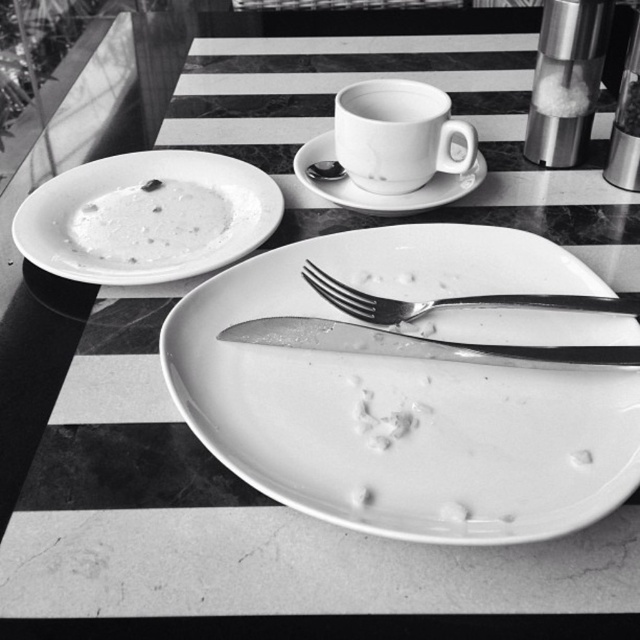
You are arranging a table for a dinner party and need to place a centerpiece. The table has a white glossy plate at center. Where should you place the centerpiece to avoid covering the plate?

The white glossy plate at center is located at point (404, 396), so you should place the centerpiece away from that coordinate to avoid covering it.

You are standing in front of the table and want to place a small decoration between the two points labeled as point (326,154) and point (609,310). Which point should you move toward first to ensure the decoration is closer to you?

You should move toward point (326,154) first because it is closer to you than point (609,310), ensuring the decoration will be positioned nearer to your current location.

You are arranging a dinner table and want to place a decorative napkin ring between the shiny silver knife at center and the metallic silver pepper grinder at upper right. Based on their positions, where should you place it?

The shiny silver knife at center is positioned under the metallic silver pepper grinder at upper right, so you should place the napkin ring between them, ensuring it is above the knife and below the pepper grinder to maintain the spatial arrangement.